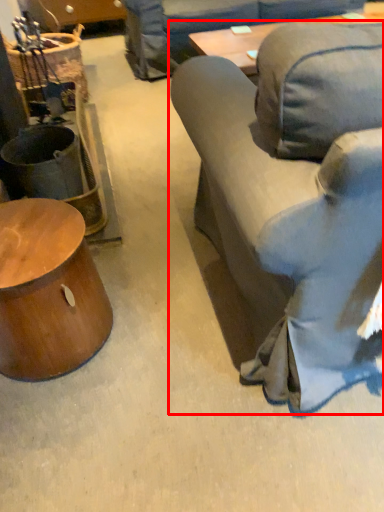
Question: Where is studio couch (annotated by the red box) located in relation to table in the image?

Choices:
 (A) left
 (B) right

Answer: (B)